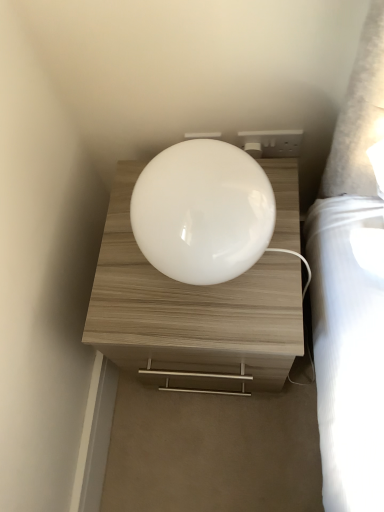
What do you see at coordinates (271, 142) in the screenshot? I see `white plastic socket at upper right` at bounding box center [271, 142].

The height and width of the screenshot is (512, 384). In order to click on white glossy nightstand at center in this screenshot , I will do `click(192, 314)`.

Where is `white plastic socket at upper right`? The height and width of the screenshot is (512, 384). white plastic socket at upper right is located at coordinates (271, 142).

I want to click on oval on the left of white plastic socket at upper right, so click(x=202, y=212).

Considering the positions of objects white glossy lampshade at center and white plastic socket at upper right in the image provided, who is more to the right, white glossy lampshade at center or white plastic socket at upper right?

white plastic socket at upper right is more to the right.

Is white glossy lampshade at center bigger than white plastic socket at upper right?

Correct, white glossy lampshade at center is larger in size than white plastic socket at upper right.

Is white plastic socket at upper right completely or partially inside white glossy lampshade at center?

No, white glossy lampshade at center does not contain white plastic socket at upper right.

Can you confirm if white plastic socket at upper right is bigger than white glossy nightstand at center?

Incorrect, white plastic socket at upper right is not larger than white glossy nightstand at center.

From the image's perspective, does white plastic socket at upper right appear lower than white glossy nightstand at center?

Actually, white plastic socket at upper right appears above white glossy nightstand at center in the image.

You are a GUI agent. You are given a task and a screenshot of the screen. Output one action in this format:
    pyautogui.click(x=<x>, y=<y>)
    Task: Click on the nightstand that appears below the white plastic socket at upper right (from the image's perspective)
    The height and width of the screenshot is (512, 384).
    Given the screenshot: What is the action you would take?
    pyautogui.click(x=192, y=314)

From the picture: Is white plastic socket at upper right thinner than white glossy nightstand at center?

Yes, white plastic socket at upper right is thinner than white glossy nightstand at center.

How many degrees apart are the facing directions of white glossy nightstand at center and white plastic socket at upper right?

The angle between the facing direction of white glossy nightstand at center and the facing direction of white plastic socket at upper right is 0.474 degrees.

Considering the sizes of white glossy nightstand at center and white plastic socket at upper right in the image, is white glossy nightstand at center taller or shorter than white plastic socket at upper right?

Considering their sizes, white glossy nightstand at center has more height than white plastic socket at upper right.

Is white glossy nightstand at center further to camera compared to white plastic socket at upper right?

No, it is not.

Between white plastic socket at upper right and white glossy lampshade at center, which one has larger size?

white glossy lampshade at center.

From a real-world perspective, is white plastic socket at upper right positioned over white glossy lampshade at center based on gravity?

Actually, white plastic socket at upper right is physically below white glossy lampshade at center in the real world.

Is white glossy lampshade at center inside white plastic socket at upper right?

No, white glossy lampshade at center is not a part of white plastic socket at upper right.

In the scene shown: Does white plastic socket at upper right appear on the left side of white glossy lampshade at center?

Incorrect, white plastic socket at upper right is not on the left side of white glossy lampshade at center.

Considering the points (207, 352) and (164, 186), which point is behind, point (207, 352) or point (164, 186)?

The point (207, 352) is farther from the camera.

Would you say white glossy nightstand at center is outside white glossy lampshade at center?

Yes, white glossy nightstand at center is located beyond the bounds of white glossy lampshade at center.

Does white glossy nightstand at center have a lesser height compared to white glossy lampshade at center?

No.

In the scene shown: Considering the relative sizes of white glossy nightstand at center and white glossy lampshade at center in the image provided, is white glossy nightstand at center smaller than white glossy lampshade at center?

No.

Which is more to the left, white glossy lampshade at center or white glossy nightstand at center?

Positioned to the left is white glossy lampshade at center.

This screenshot has width=384, height=512. I want to click on nightstand that is below the white glossy lampshade at center (from the image's perspective), so click(x=192, y=314).

From the image's perspective, does white glossy lampshade at center appear lower than white glossy nightstand at center?

No, from the image's perspective, white glossy lampshade at center is not beneath white glossy nightstand at center.

Where is `electric outlet behind the white glossy lampshade at center`? electric outlet behind the white glossy lampshade at center is located at coordinates (271, 142).

I want to click on nightstand below the white plastic socket at upper right (from a real-world perspective), so click(192, 314).

Considering their positions, is white glossy nightstand at center positioned further to white glossy lampshade at center than white plastic socket at upper right?

white plastic socket at upper right is positioned further to the anchor white glossy lampshade at center.

Which object lies further to the anchor point white glossy lampshade at center, white plastic socket at upper right or white glossy nightstand at center?

white plastic socket at upper right is positioned further to the anchor white glossy lampshade at center.

Based on their spatial positions, is white glossy nightstand at center or white glossy lampshade at center further from white plastic socket at upper right?

Among the two, white glossy nightstand at center is located further to white plastic socket at upper right.

Estimate the real-world distances between objects in this image. Which object is further from white glossy nightstand at center, white glossy lampshade at center or white plastic socket at upper right?

The object further to white glossy nightstand at center is white plastic socket at upper right.

Looking at this image, which object lies further to the anchor point white glossy nightstand at center, white plastic socket at upper right or white glossy lampshade at center?

white plastic socket at upper right.

From the picture: From the image, which object appears to be farther from white plastic socket at upper right, white glossy lampshade at center or white glossy nightstand at center?

The object further to white plastic socket at upper right is white glossy nightstand at center.

At what (x,y) coordinates should I click in order to perform the action: click on nightstand located between white glossy lampshade at center and white plastic socket at upper right in the depth direction. Please return your answer as a coordinate pair (x, y). Looking at the image, I should click on (192, 314).